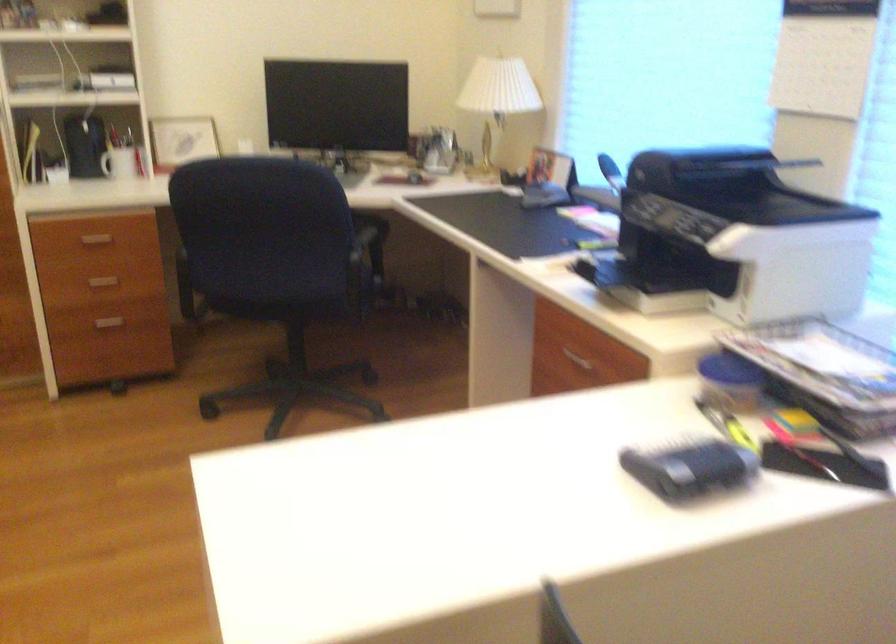
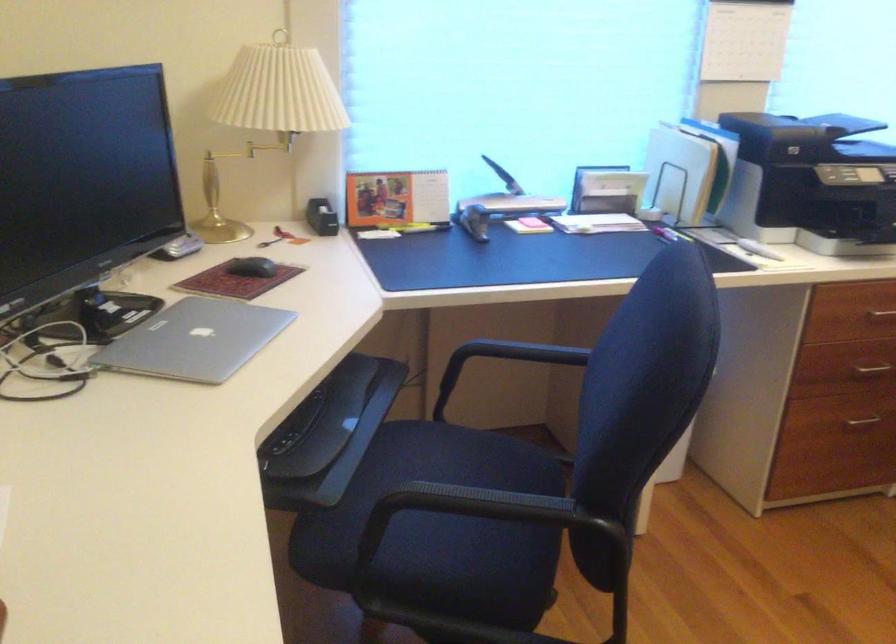
Find the pixel in the second image that matches (x=595, y=366) in the first image.

(881, 315)